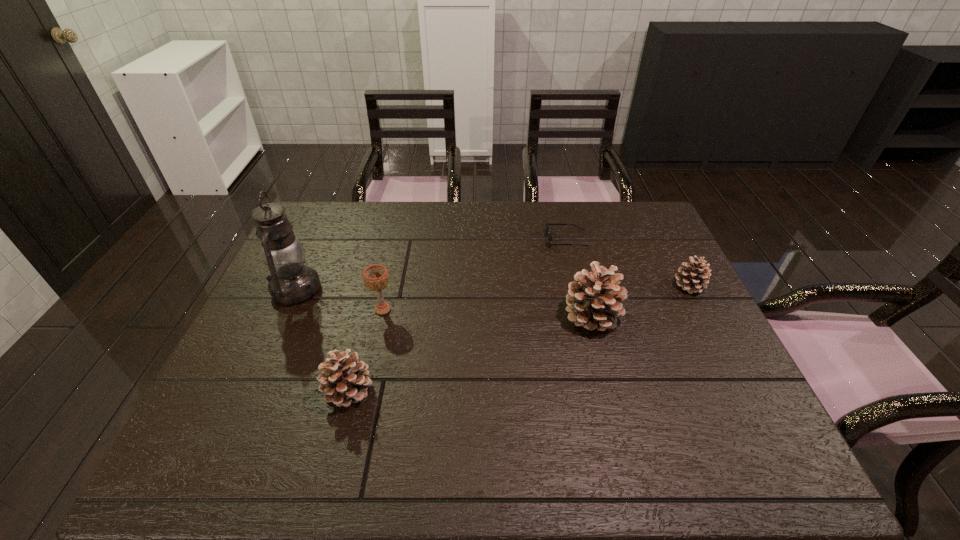
Please point a spot to place another pinecone for symmetrical spacing. Please provide its 2D coordinates. Your answer should be formatted as a tuple, i.e. [(x, y)], where the tuple contains the x and y coordinates of a point satisfying the conditions above.

[(480, 350)]